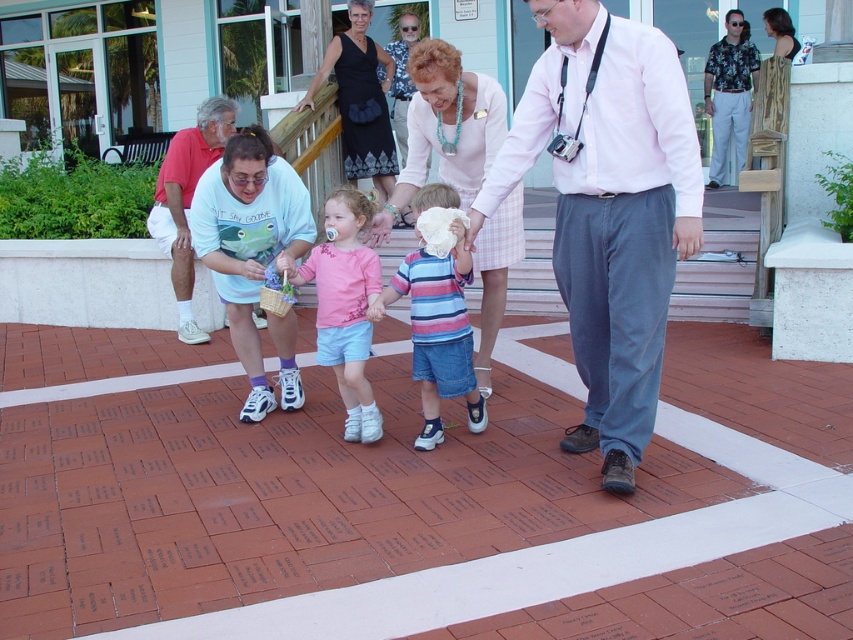
Image resolution: width=853 pixels, height=640 pixels. Describe the element at coordinates (407, 486) in the screenshot. I see `brick pavement at center` at that location.

Who is higher up, brick pavement at center or pink shirt at center?

pink shirt at center is higher up.

Which is in front, point (723, 432) or point (584, 40)?

Positioned in front is point (584, 40).

Locate an element on the screen. The image size is (853, 640). brick pavement at center is located at coordinates coord(407,486).

Is striped cotton shirt at center below pink fabric shirt at center?

Yes.

Does striped cotton shirt at center come behind pink fabric shirt at center?

No, striped cotton shirt at center is closer to the viewer.

In the scene shown: Who is more forward, (x=422, y=308) or (x=378, y=269)?

Positioned in front is point (x=422, y=308).

Image resolution: width=853 pixels, height=640 pixels. Find the location of `striped cotton shirt at center`. striped cotton shirt at center is located at coordinates (438, 332).

This screenshot has height=640, width=853. What do you see at coordinates (608, 208) in the screenshot?
I see `matte pink dress at center` at bounding box center [608, 208].

Between matte pink dress at center and pink shirt at center, which one appears on the right side from the viewer's perspective?

pink shirt at center is more to the right.

Describe the element at coordinates (608, 208) in the screenshot. I see `matte pink dress at center` at that location.

You are a GUI agent. You are given a task and a screenshot of the screen. Output one action in this format:
    pyautogui.click(x=<x>, y=<y>)
    Task: Click on the matte pink dress at center
    
    Given the screenshot: What is the action you would take?
    pyautogui.click(x=608, y=208)